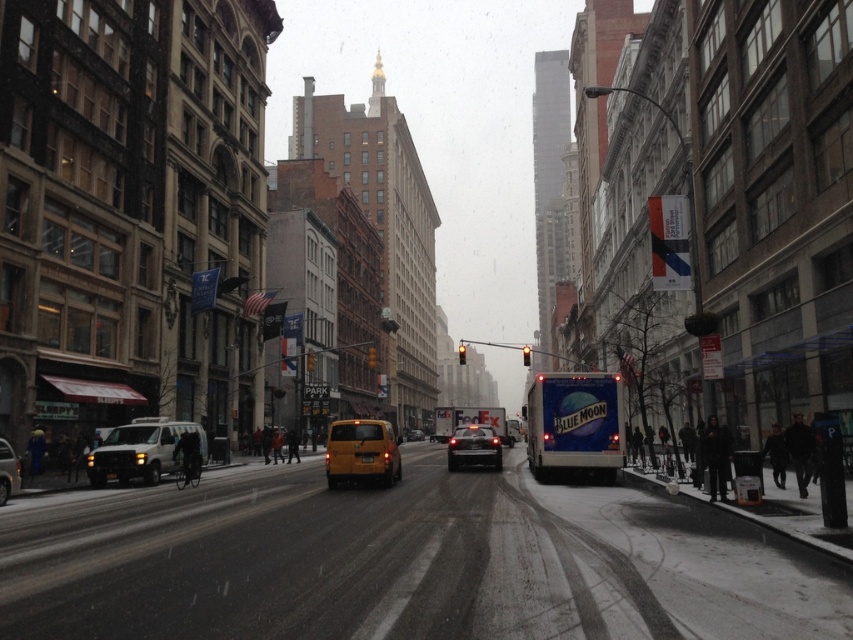
Question: Can you confirm if yellow matte taxi cab at center is positioned to the left of yellow matte van at center?

Choices:
 (A) yes
 (B) no

Answer: (A)

Question: Which object is farther from the camera taking this photo?

Choices:
 (A) matte black van at lower left
 (B) shiny black sedan at center
 (C) yellow matte taxi cab at center
 (D) yellow matte van at center

Answer: (D)

Question: Which of these objects is positioned closest to the yellow matte taxi at center?

Choices:
 (A) yellow matte van at center
 (B) shiny black sedan at center
 (C) matte black van at lower left

Answer: (C)

Question: Is matte black van at lower left to the left of yellow matte taxi cab at center from the viewer's perspective?

Choices:
 (A) yes
 (B) no

Answer: (A)

Question: Which point is closer to the camera?

Choices:
 (A) (468, 440)
 (B) (383, 428)
 (C) (138, 449)

Answer: (B)

Question: Can you confirm if shiny black sedan at center is thinner than yellow matte van at center?

Choices:
 (A) no
 (B) yes

Answer: (A)